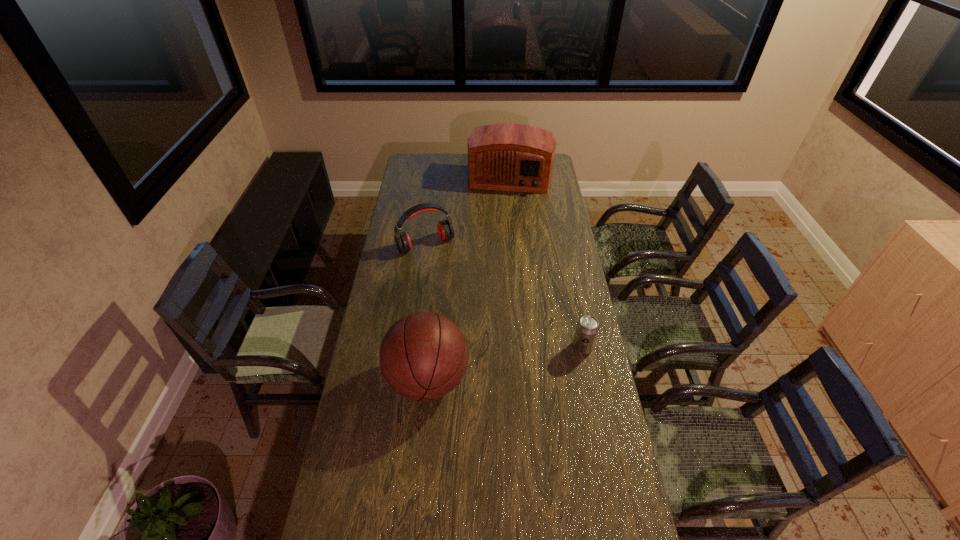
In order to click on blank space at the near edge in this screenshot , I will do `click(537, 500)`.

The image size is (960, 540). What are the coordinates of `vacant area at the left edge` in the screenshot? It's located at (352, 438).

This screenshot has height=540, width=960. What are the coordinates of `vacant space at the right edge` in the screenshot? It's located at (569, 379).

This screenshot has height=540, width=960. Identify the location of vacant region between the radio receiver and the second farthest object. (468, 210).

Locate an element on the screen. This screenshot has height=540, width=960. vacant area between the basketball and the shortest object is located at coordinates pyautogui.click(x=505, y=363).

In order to click on vacant space that's between the beer can and the basketball in this screenshot , I will do `click(505, 363)`.

The height and width of the screenshot is (540, 960). I want to click on unoccupied position between the basketball and the shortest object, so click(505, 363).

Locate an element on the screen. Image resolution: width=960 pixels, height=540 pixels. vacant space that's between the farthest object and the beer can is located at coordinates (546, 262).

Find the location of a particular element. Image resolution: width=960 pixels, height=540 pixels. free spot between the beer can and the basketball is located at coordinates (505, 363).

The height and width of the screenshot is (540, 960). I want to click on free spot between the basketball and the shortest object, so click(505, 363).